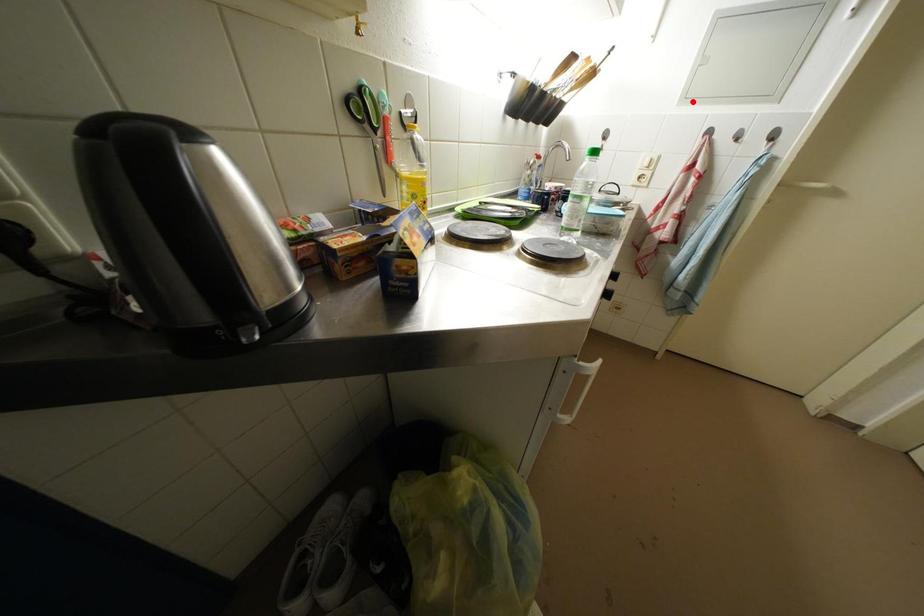
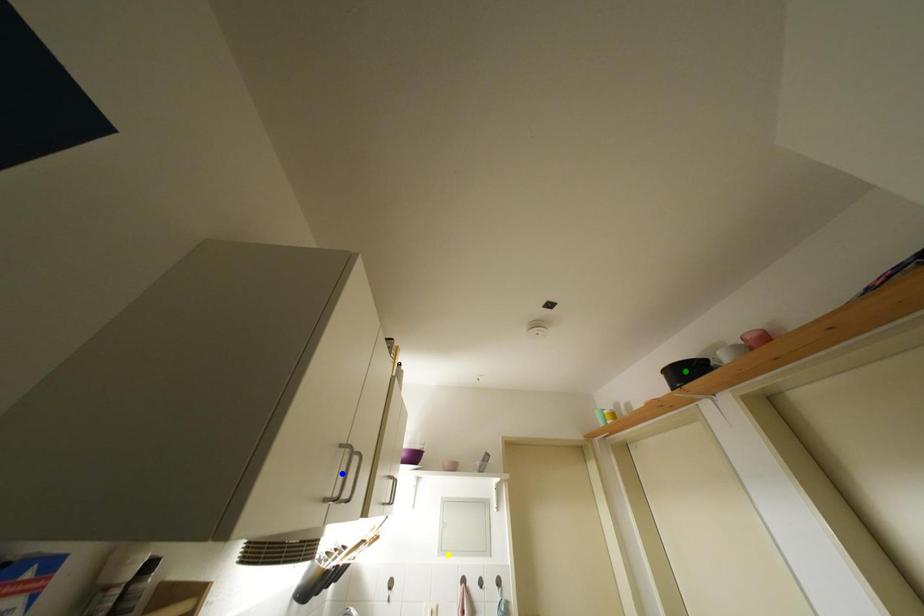
Question: I am providing you with two images of the same scene from different viewpoints. A red point is marked on the first image. You are given multiple points on the second image. Which mark in image 2 goes with the point in image 1?

Choices:
 (A) blue point
 (B) yellow point
 (C) green point

Answer: (B)